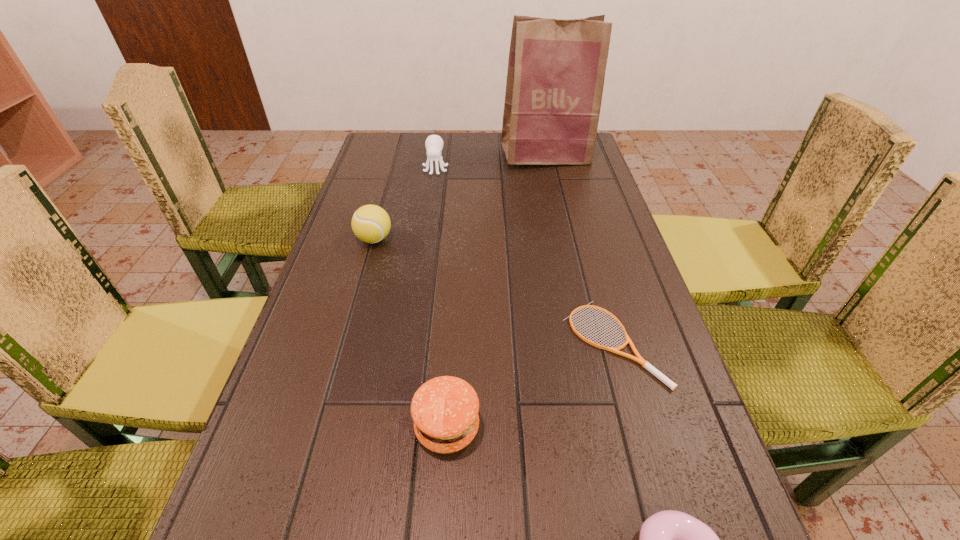
This screenshot has height=540, width=960. I want to click on free space at the right edge of the desktop, so click(560, 170).

Where is `free point between the tennis racket and the second nearest object`? The width and height of the screenshot is (960, 540). free point between the tennis racket and the second nearest object is located at coordinates (530, 386).

Image resolution: width=960 pixels, height=540 pixels. I want to click on free space that is in between the fourth nearest object and the tennis racket, so [493, 291].

You are a GUI agent. You are given a task and a screenshot of the screen. Output one action in this format:
    pyautogui.click(x=<x>, y=<y>)
    Task: Click on the vacant region between the fourth farthest object and the leftmost object
    
    Given the screenshot: What is the action you would take?
    pyautogui.click(x=493, y=291)

Identify the location of vacant space in between the fifth farthest object and the leftmost object. (411, 333).

I want to click on empty location between the tallest object and the third farthest object, so click(460, 197).

Locate which object is the closest to the octopus. Please provide its 2D coordinates. Your answer should be formatted as a tuple, i.e. [(x, y)], where the tuple contains the x and y coordinates of a point satisfying the conditions above.

[(556, 68)]

What are the coordinates of `object that is the fifth closest to the patty` in the screenshot? It's located at (556, 68).

Find the location of `vacant space that satisfies the following two spatial constraints: 1. on the front-facing side of the tennis racket; 2. on the left side of the tallest object`. vacant space that satisfies the following two spatial constraints: 1. on the front-facing side of the tennis racket; 2. on the left side of the tallest object is located at coordinates (588, 343).

Image resolution: width=960 pixels, height=540 pixels. I want to click on free spot that satisfies the following two spatial constraints: 1. on the front-facing side of the octopus; 2. on the right side of the second nearest object, so click(x=397, y=427).